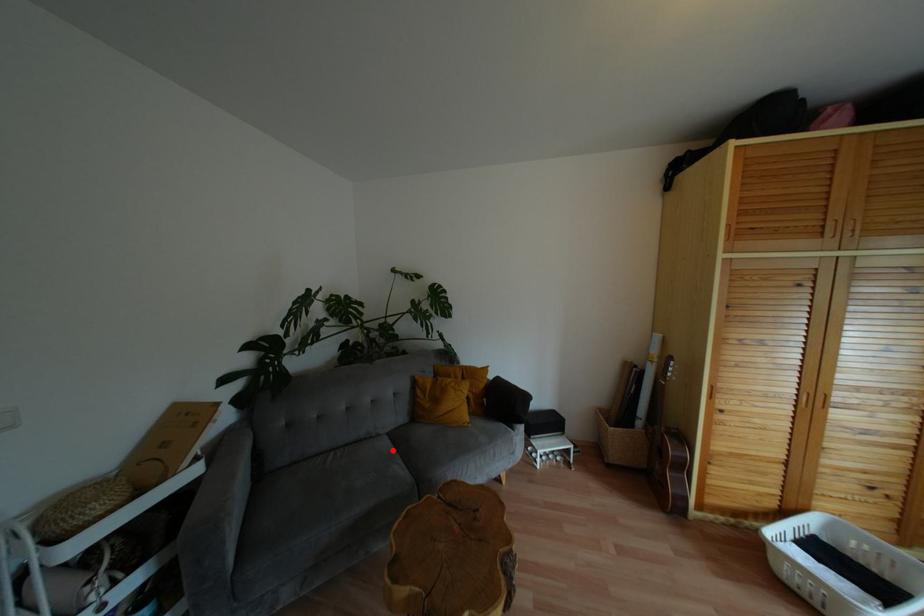
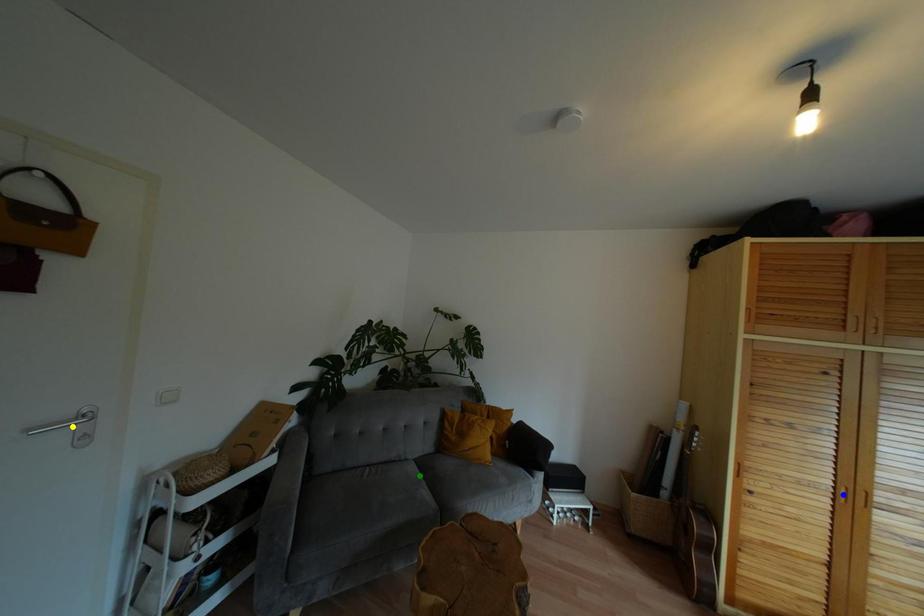
Question: I am providing you with two images of the same scene from different viewpoints. A red point is marked on the first image. You are given multiple points on the second image. Which point in image 2 represents the same 3d spot as the red point in image 1?

Choices:
 (A) blue point
 (B) yellow point
 (C) green point

Answer: (C)